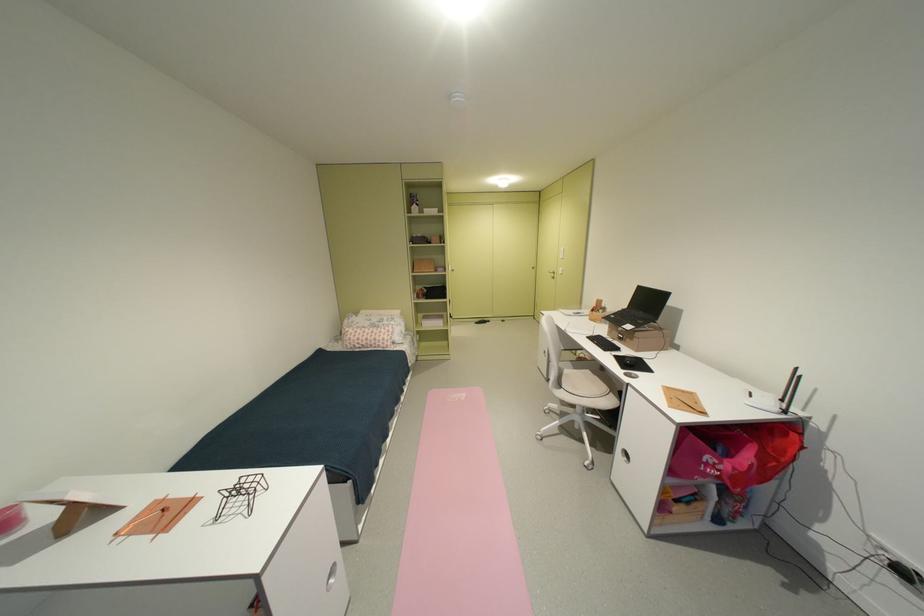
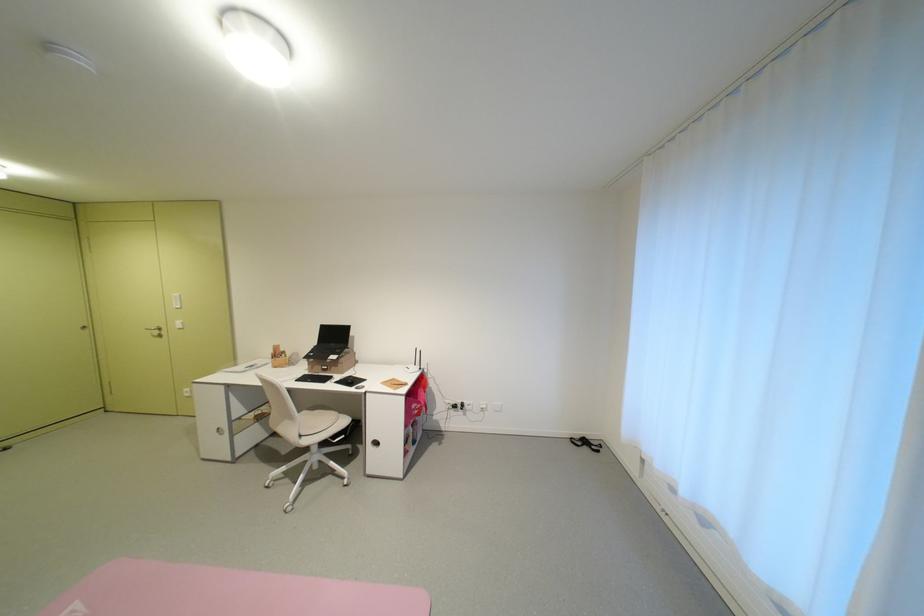
Locate, in the second image, the point that corresponds to pixel 724 464 in the first image.

(424, 408)